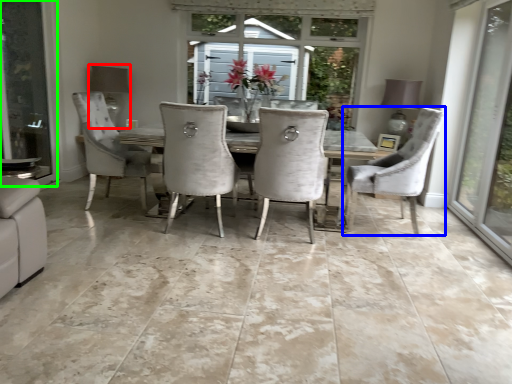
Question: Considering the real-world distances, which object is closest to lamp (highlighted by a red box)? chair (highlighted by a blue box) or screen door (highlighted by a green box).

Choices:
 (A) chair
 (B) screen door

Answer: (B)